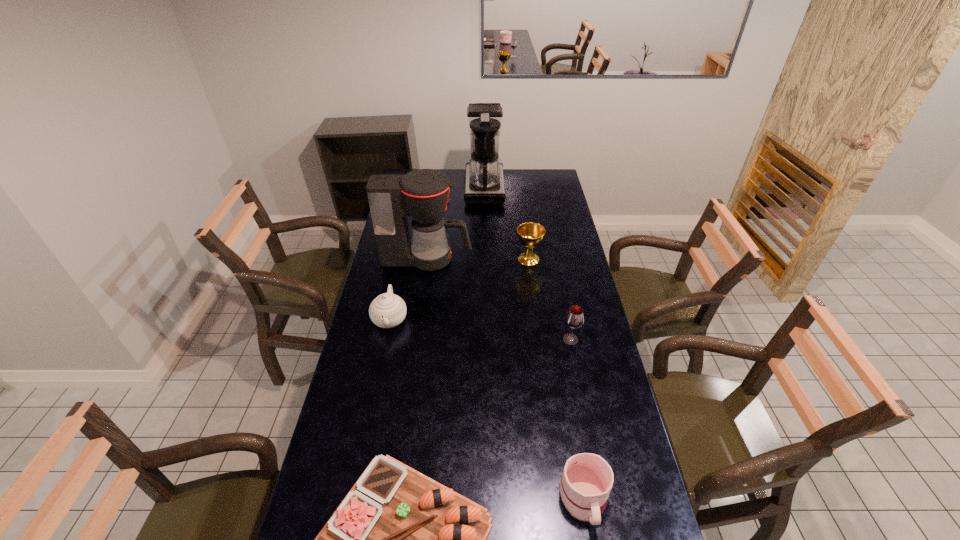
This screenshot has width=960, height=540. I want to click on free region that satisfies the following two spatial constraints: 1. at the front of the farthest object where the controls are located; 2. on the left side of the wineglass, so click(x=486, y=340).